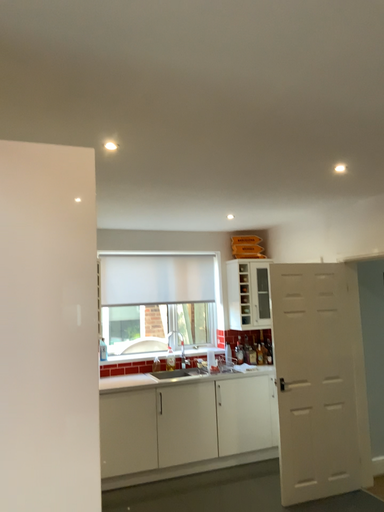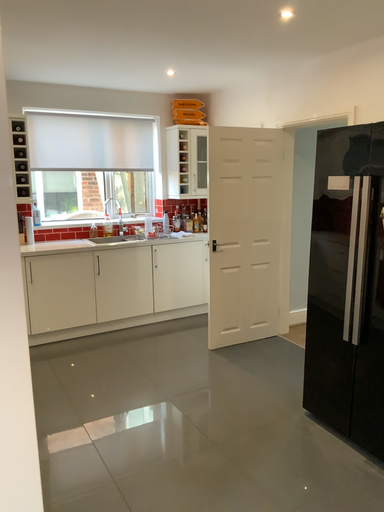
Question: How did the camera likely rotate when shooting the video?

Choices:
 (A) rotated downward
 (B) rotated upward

Answer: (A)